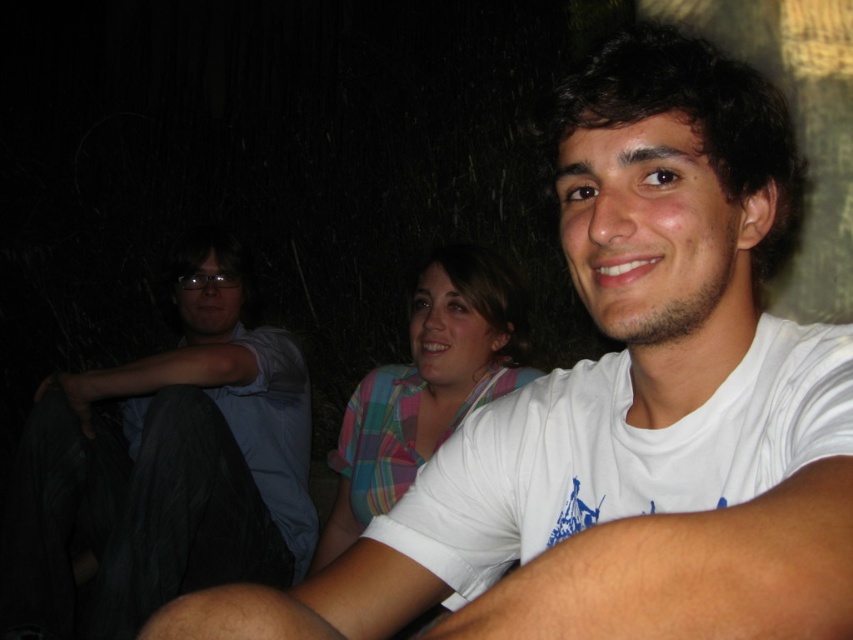
You are standing in a dark park at night and see a person wearing a light blue shirt at left. Where would you look to find them based on their position coordinates?

The light blue shirt at left is located at point (x=165, y=467), so you should look towards the lower left area of the frame to find them.